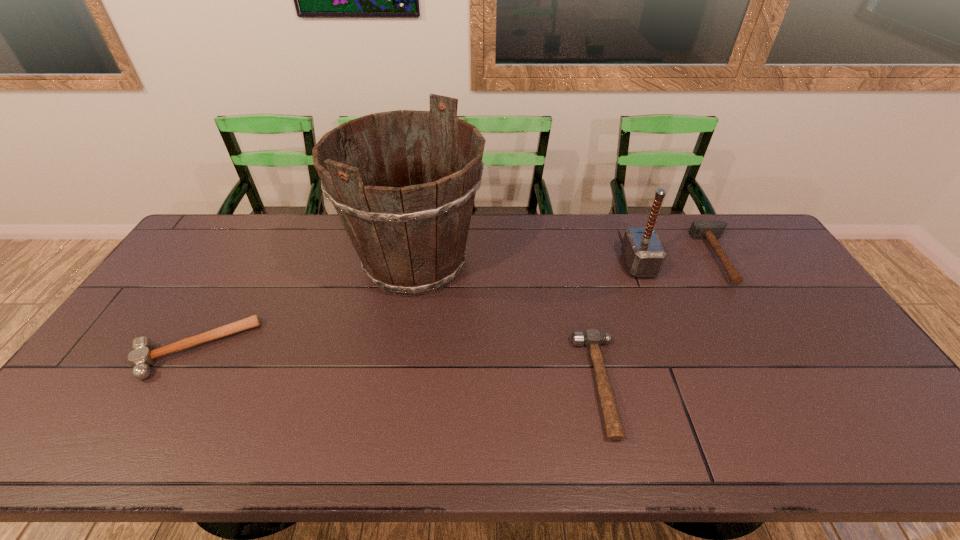
You are a GUI agent. You are given a task and a screenshot of the screen. Output one action in this format:
    pyautogui.click(x=<x>, y=<y>)
    Task: Click on the tallest object
    
    Given the screenshot: What is the action you would take?
    pyautogui.click(x=411, y=240)

The width and height of the screenshot is (960, 540). I want to click on bucket, so click(411, 240).

The width and height of the screenshot is (960, 540). What are the coordinates of `the second tallest object` in the screenshot? It's located at (643, 253).

What are the coordinates of `the second hammer from right to left` in the screenshot? It's located at (643, 253).

The width and height of the screenshot is (960, 540). Find the location of `the third shortest object`. the third shortest object is located at coordinates (711, 230).

Locate an element on the screen. The height and width of the screenshot is (540, 960). the rightmost hammer is located at coordinates (711, 230).

In order to click on the leftmost object in this screenshot , I will do `click(141, 357)`.

The image size is (960, 540). In order to click on the second hammer from left to right in this screenshot , I will do `click(592, 338)`.

The width and height of the screenshot is (960, 540). In order to click on vacant position located 0.280m on the front of the bucket in this screenshot , I will do `click(394, 398)`.

Where is `vacant space located on the front of the second tallest object`? vacant space located on the front of the second tallest object is located at coordinates (669, 343).